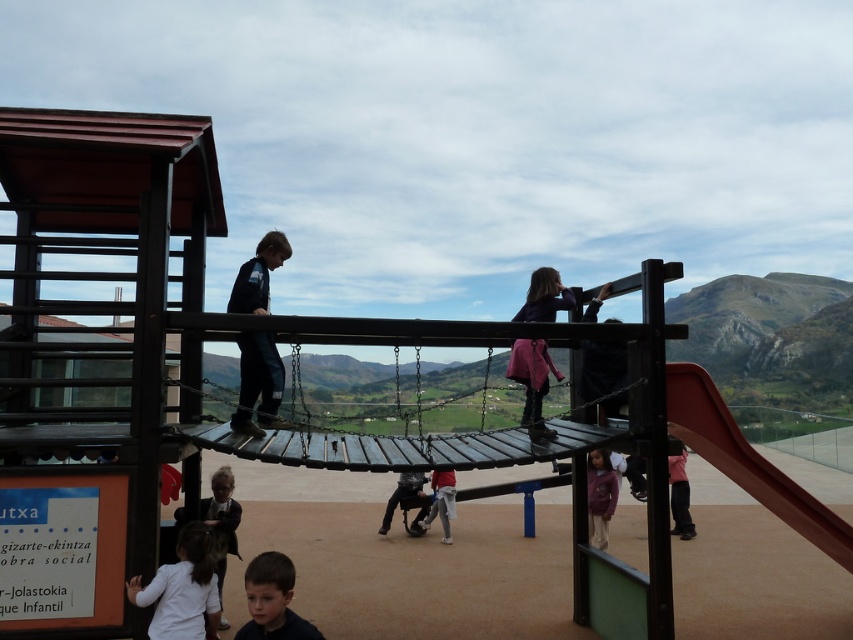
Question: Which object is positioned closest to the light gray fabric pants at center?

Choices:
 (A) pink fabric pants at lower right
 (B) smooth red slide at right
 (C) dark blue jeans at center
 (D) dark gray fabric pants at center

Answer: (D)

Question: Where is dark blue hair at lower center located in relation to light gray fabric pants at center in the image?

Choices:
 (A) above
 (B) below

Answer: (A)

Question: Which point is farther to the camera?

Choices:
 (A) smooth red slide at right
 (B) dark blue hair at lower center

Answer: (A)

Question: Estimate the real-world distances between objects in this image. Which object is farther from the purple fleece jacket at lower center?

Choices:
 (A) dark blue jeans at center
 (B) dark blue fabric at upper right
 (C) dark gray fabric pants at center
 (D) pink fabric pants at lower right

Answer: (A)

Question: Observing the image, what is the correct spatial positioning of dark blue jeans at center in reference to purple fleece jacket at lower center?

Choices:
 (A) right
 (B) left

Answer: (B)

Question: Is dark blue jeans at center to the left of light gray fabric pants at center from the viewer's perspective?

Choices:
 (A) no
 (B) yes

Answer: (B)